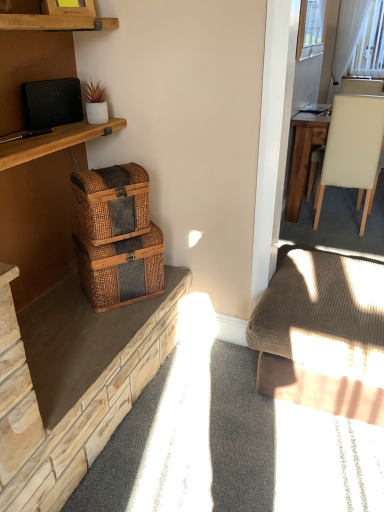
Question: From a real-world perspective, is woven wood baskets at left over black matte speaker at upper left?

Choices:
 (A) yes
 (B) no

Answer: (B)

Question: Is woven wood baskets at left surrounding black matte speaker at upper left?

Choices:
 (A) no
 (B) yes

Answer: (A)

Question: Does woven wood baskets at left come in front of black matte speaker at upper left?

Choices:
 (A) yes
 (B) no

Answer: (A)

Question: Can you confirm if woven wood baskets at left is smaller than black matte speaker at upper left?

Choices:
 (A) no
 (B) yes

Answer: (A)

Question: From a real-world perspective, is woven wood baskets at left beneath black matte speaker at upper left?

Choices:
 (A) yes
 (B) no

Answer: (A)

Question: In terms of height, does woven brown picnic basket at lower left, the 2th picnic basket viewed from the top, look taller or shorter compared to beige leather chair at right?

Choices:
 (A) tall
 (B) short

Answer: (B)

Question: Is woven brown picnic basket at lower left, the 2th picnic basket viewed from the top, bigger or smaller than beige leather chair at right?

Choices:
 (A) small
 (B) big

Answer: (A)

Question: Considering the relative positions of woven brown picnic basket at lower left, the 2th picnic basket viewed from the top, and beige leather chair at right in the image provided, is woven brown picnic basket at lower left, the 2th picnic basket viewed from the top, to the left or to the right of beige leather chair at right?

Choices:
 (A) right
 (B) left

Answer: (B)

Question: In the image, is woven brown picnic basket at lower left, the 2th picnic basket viewed from the top, positioned in front of or behind beige leather chair at right?

Choices:
 (A) behind
 (B) front

Answer: (B)

Question: In terms of size, does white sheer curtain at upper right appear bigger or smaller than black matte speaker at upper left?

Choices:
 (A) small
 (B) big

Answer: (B)

Question: Considering the relative positions of white sheer curtain at upper right and black matte speaker at upper left in the image provided, is white sheer curtain at upper right to the left or to the right of black matte speaker at upper left?

Choices:
 (A) left
 (B) right

Answer: (B)

Question: Is white sheer curtain at upper right taller or shorter than black matte speaker at upper left?

Choices:
 (A) tall
 (B) short

Answer: (A)

Question: Would you say white sheer curtain at upper right is inside or outside black matte speaker at upper left?

Choices:
 (A) inside
 (B) outside

Answer: (B)

Question: Is point (36, 344) positioned closer to the camera than point (345, 0)?

Choices:
 (A) closer
 (B) farther

Answer: (A)

Question: From a real-world perspective, is woven wood baskets at left positioned above or below white sheer curtain at upper right?

Choices:
 (A) above
 (B) below

Answer: (B)